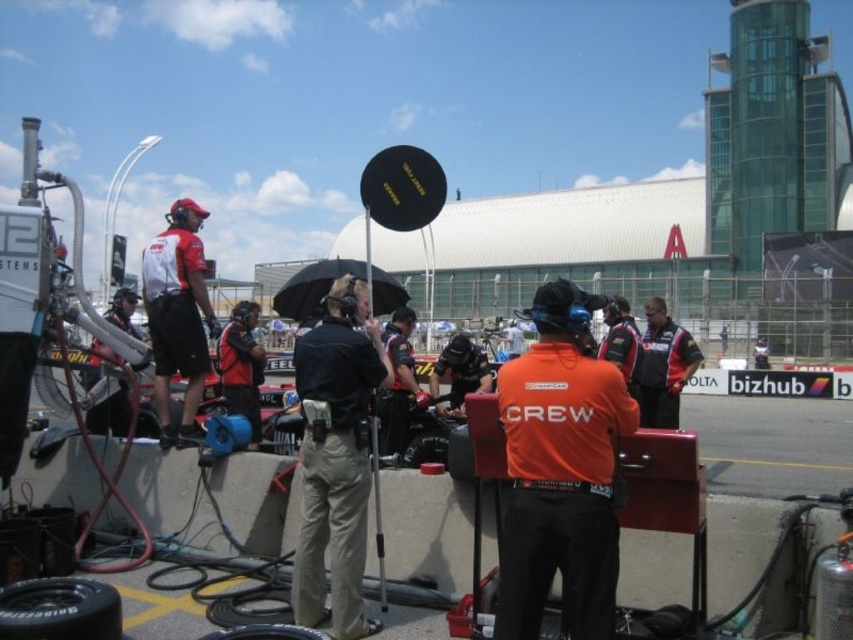
You are a photographer at the pit stop area and want to capture both the black rubber tire at lower left and the black rubber tire at lower center in your shot. Which tire should you focus on first to ensure both are in frame?

The black rubber tire at lower left is closer to the viewer than the black rubber tire at lower center, so focus on the black rubber tire at lower left first to ensure both tires are in frame.

You are a photographer positioned at the pit stop area. You want to take a photo focusing on the black rubber tire at center but need to ensure the black matte umbrella at center doesn

The black matte umbrella at center is closer to the viewer than the black rubber tire at center, so it will appear in front of the tire in the photo. To focus on the tire, you should adjust your position to avoid the umbrella blocking the view.